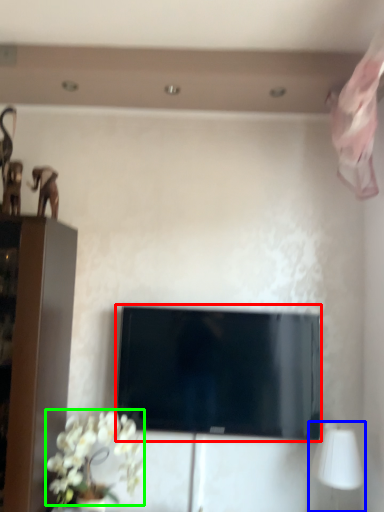
Question: Considering the real-world distances, which object is farthest from television (highlighted by a red box)? table lamp (highlighted by a blue box) or flower (highlighted by a green box)?

Choices:
 (A) table lamp
 (B) flower

Answer: (A)